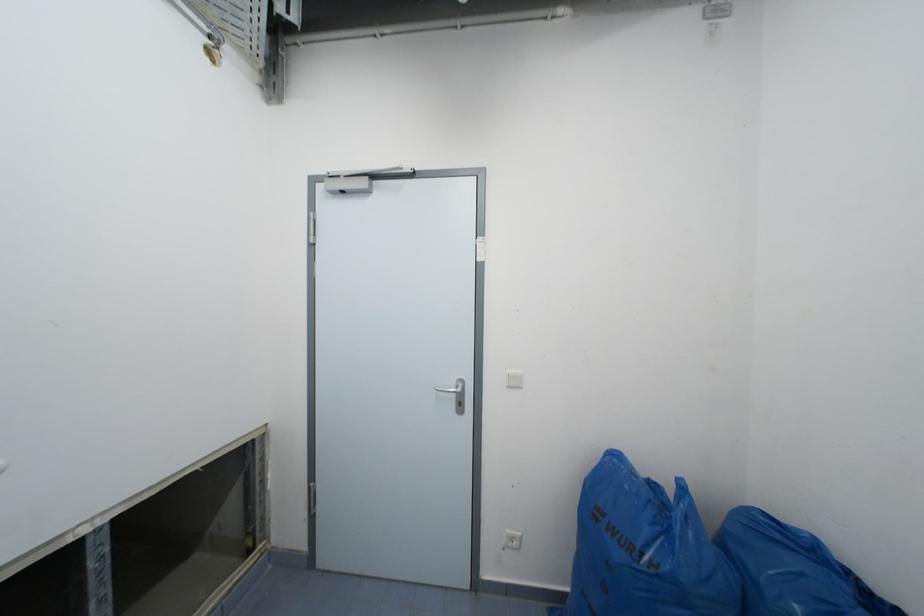
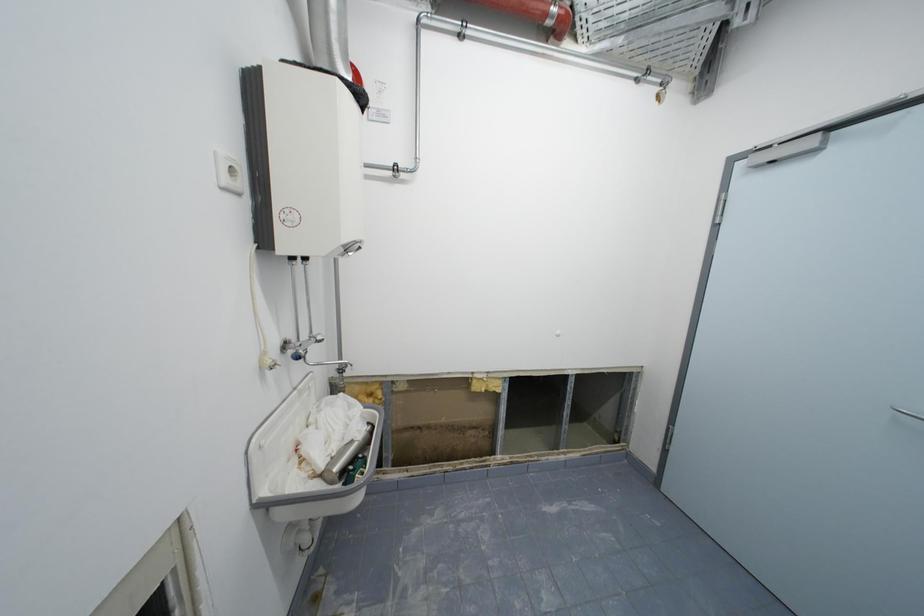
Question: The camera is either moving clockwise (left) or counter-clockwise (right) around the object. The first image is from the beginning of the video and the second image is from the end. Is the camera moving left or right when shooting the video?

Choices:
 (A) Left
 (B) Right

Answer: (B)